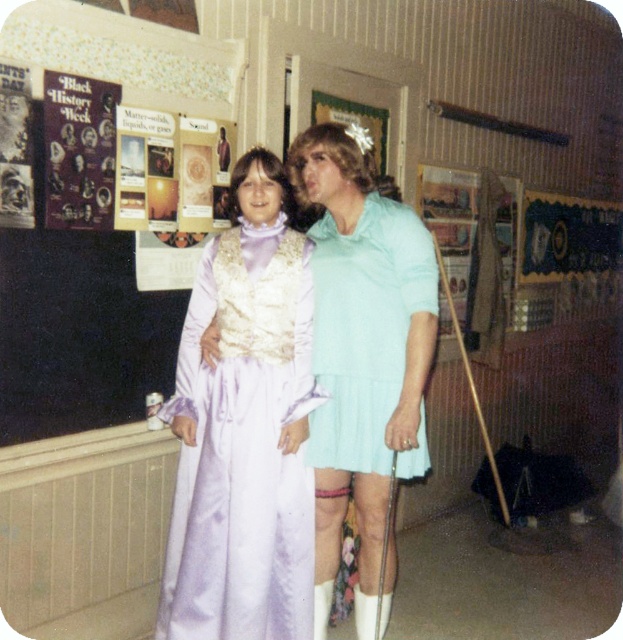
Between light blue pleated dress at center and light blue pleated skirt at center, which one has less height?

light blue pleated skirt at center

Based on the photo, does light blue pleated dress at center have a smaller size compared to light blue pleated skirt at center?

Incorrect, light blue pleated dress at center is not smaller in size than light blue pleated skirt at center.

Locate an element on the screen. This screenshot has width=623, height=640. light blue pleated dress at center is located at coordinates (363, 352).

Find the location of a particular element. light blue pleated dress at center is located at coordinates (363, 352).

Does lavender satin dress at center have a smaller size compared to light blue pleated skirt at center?

Incorrect, lavender satin dress at center is not smaller in size than light blue pleated skirt at center.

Where is `lavender satin dress at center`? This screenshot has height=640, width=623. lavender satin dress at center is located at coordinates (244, 448).

The image size is (623, 640). Find the location of `lavender satin dress at center`. lavender satin dress at center is located at coordinates (244, 448).

Which of these two, lavender satin dress at center or light blue pleated dress at center, stands taller?

light blue pleated dress at center is taller.

Find the location of a particular element. This screenshot has width=623, height=640. lavender satin dress at center is located at coordinates (244, 448).